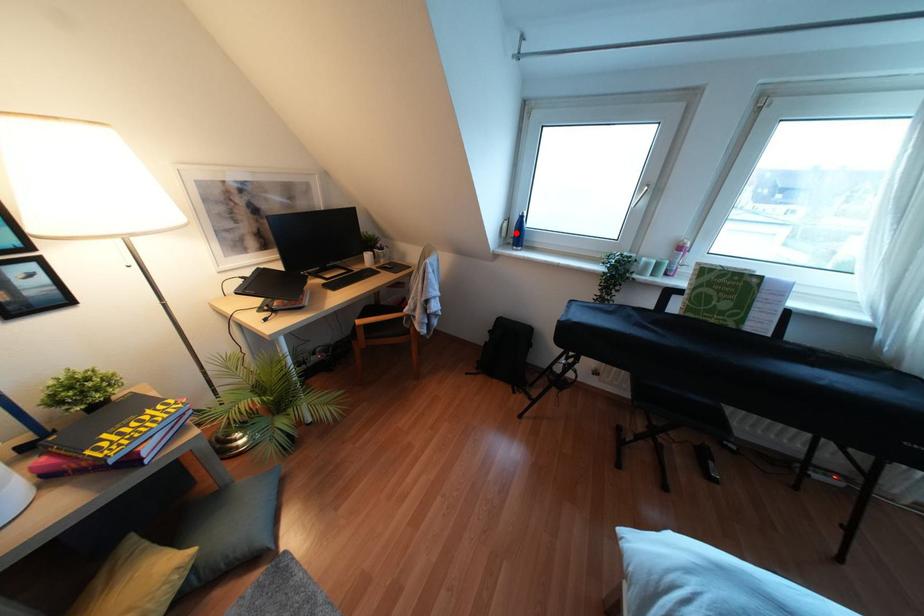
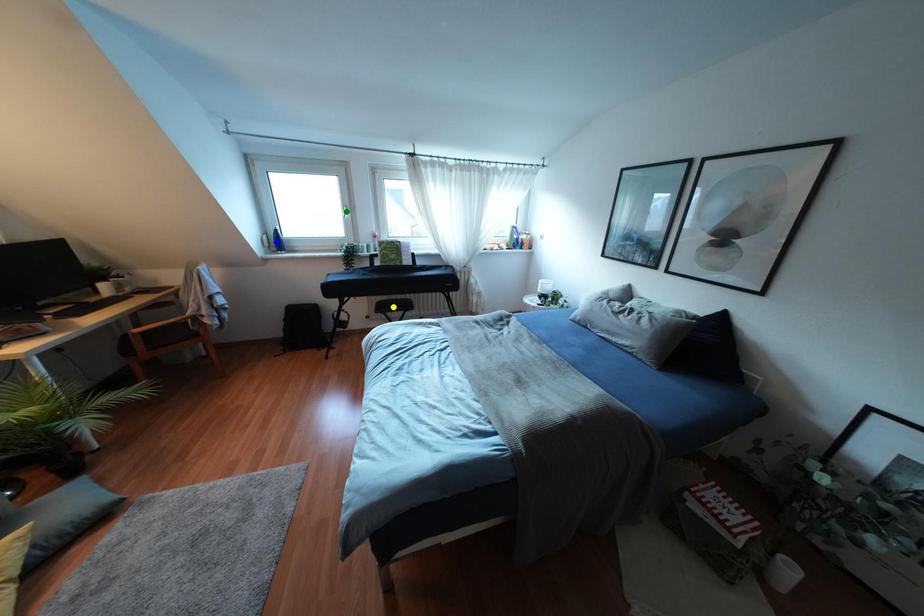
Question: I am providing you with two images of the same scene from different viewpoints. A red point is marked on the first image. You are given multiple points on the second image. Which point in image 2 represents the same 3d spot as the red point in image 1?

Choices:
 (A) blue point
 (B) yellow point
 (C) green point

Answer: (A)